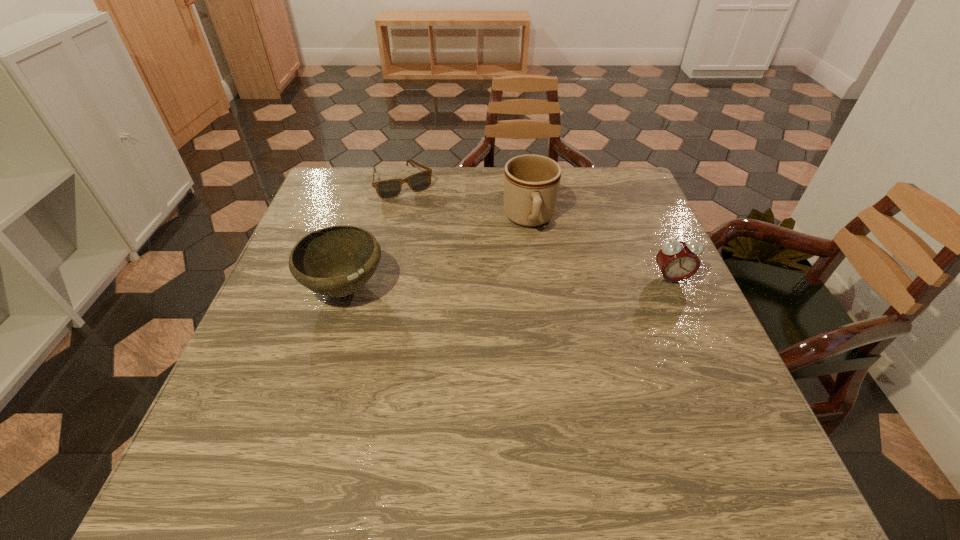
This screenshot has width=960, height=540. I want to click on free point located on the side of the mug with the handle, so click(548, 354).

Locate an element on the screen. vacant area situated on the side of the mug with the handle is located at coordinates (537, 268).

Find the location of `sunglasses located at the far edge`. sunglasses located at the far edge is located at coordinates click(x=386, y=189).

The image size is (960, 540). Identify the location of mug located in the far edge section of the desktop. (531, 182).

The height and width of the screenshot is (540, 960). Identify the location of bowl located at the left edge. 336,261.

Locate an element on the screen. The height and width of the screenshot is (540, 960). sunglasses situated at the left edge is located at coordinates (386, 189).

Where is `object at the right edge`? The height and width of the screenshot is (540, 960). object at the right edge is located at coordinates (677, 260).

What are the coordinates of `object positioned at the far left corner` in the screenshot? It's located at (386, 189).

This screenshot has height=540, width=960. In order to click on vacant space at the far edge in this screenshot , I will do `click(395, 203)`.

At what (x,y) coordinates should I click in order to perform the action: click on vacant point at the near edge. Please return your answer as a coordinate pair (x, y). This screenshot has width=960, height=540. Looking at the image, I should click on (386, 428).